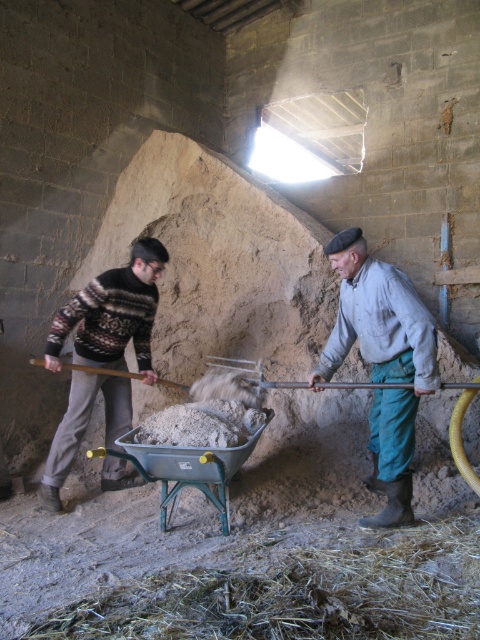
Which of these two, gray cotton shirt at center or metal/grey wheelbarrow at center, stands taller?

Standing taller between the two is gray cotton shirt at center.

Which is more to the right, gray cotton shirt at center or metal/grey wheelbarrow at center?

gray cotton shirt at center is more to the right.

Identify the location of gray cotton shirt at center. (383, 362).

Which of these two, gray cotton shirt at center or wooden handle shovel at left, stands shorter?

wooden handle shovel at left is shorter.

Does gray cotton shirt at center appear on the right side of wooden handle shovel at left?

Correct, you'll find gray cotton shirt at center to the right of wooden handle shovel at left.

Is point (412, 376) farther from camera compared to point (62, 365)?

That is False.

The height and width of the screenshot is (640, 480). Identify the location of gray cotton shirt at center. (383, 362).

Does brown straw at lower center lie in front of wooden handle shovel at left?

Yes, it is in front of wooden handle shovel at left.

This screenshot has width=480, height=640. Identify the location of brown straw at lower center. (298, 592).

Find the location of a particular element. brown straw at lower center is located at coordinates (298, 592).